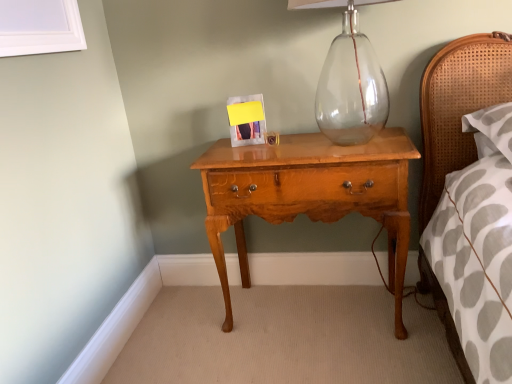
Identify the location of vacant area to the right of yellow paper at center. (293, 141).